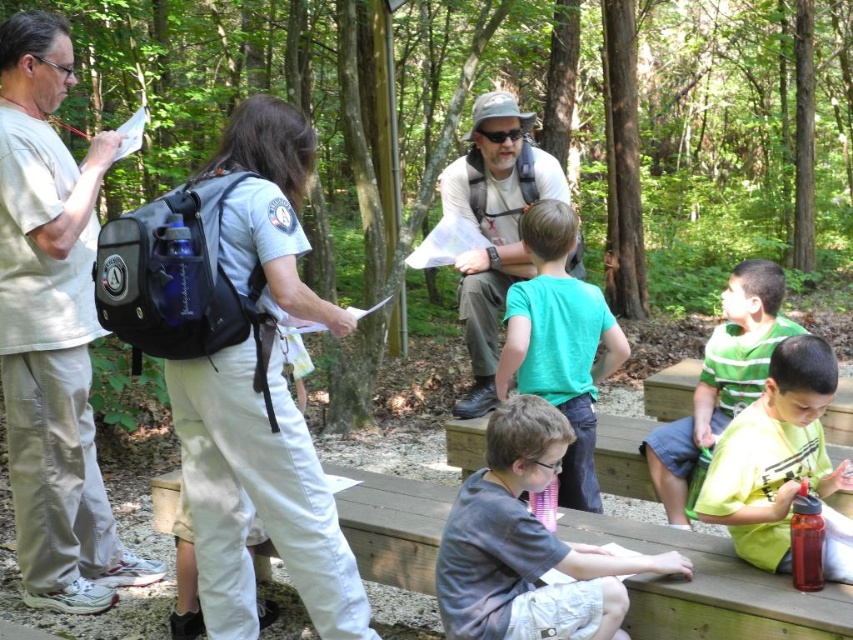
Question: Can you confirm if gray cotton shirt at lower center is smaller than wooden picnic table at lower center?

Choices:
 (A) no
 (B) yes

Answer: (A)

Question: Observing the image, what is the correct spatial positioning of matte green shirt at lower right in reference to teal t-shirt at center?

Choices:
 (A) right
 (B) left

Answer: (A)

Question: Can you confirm if wooden picnic table at lower center is positioned below green striped shirt at lower right?

Choices:
 (A) yes
 (B) no

Answer: (A)

Question: Which of the following is the farthest from the observer?

Choices:
 (A) (732, 275)
 (B) (492, 172)

Answer: (B)

Question: Which of the following is the closest to the observer?

Choices:
 (A) matte green shirt at lower right
 (B) teal t-shirt at center

Answer: (A)

Question: Which object is farther from the camera taking this photo?

Choices:
 (A) matte green shirt at lower right
 (B) wooden picnic table at lower center
 (C) gray cotton shirt at lower center

Answer: (A)